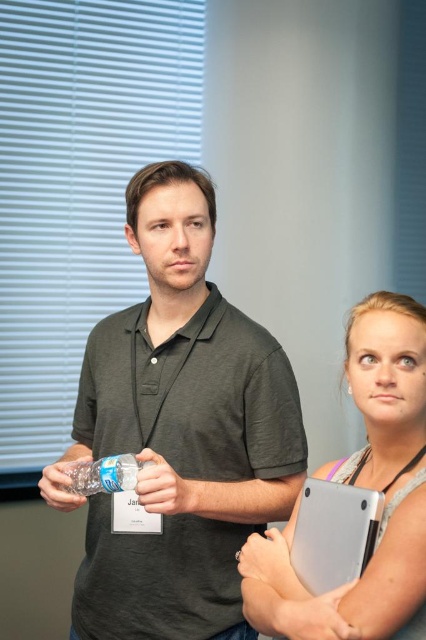
Looking at this image, you are an event planner organizing a meeting in the room where these two people are standing. You need to place a 15 cm tall decorative vase between the smooth skin hand at center and the clear plastic bottle at center. Can the vase fit vertically between them?

The smooth skin hand at center is not as tall as the clear plastic bottle at center, so the 15 cm tall decorative vase can fit vertically between them since the height difference allows space for the vase.